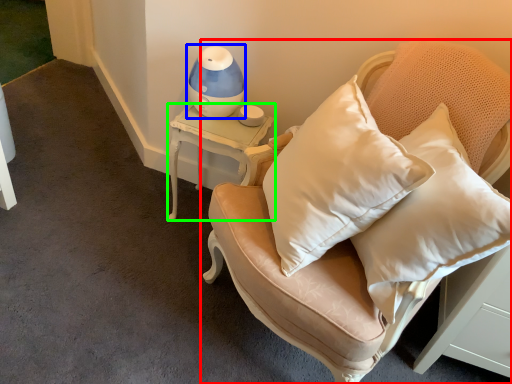
Question: Which is farther away from furniture (highlighted by a red box)? table lamp (highlighted by a blue box) or table (highlighted by a green box)?

Choices:
 (A) table lamp
 (B) table

Answer: (A)